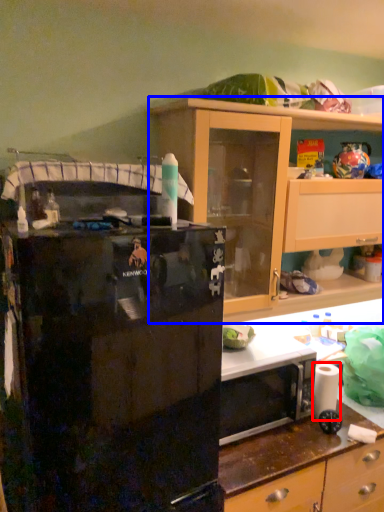
Question: Which object appears farthest to the camera in this image, toilet paper (highlighted by a red box) or cabinetry (highlighted by a blue box)?

Choices:
 (A) toilet paper
 (B) cabinetry

Answer: (A)